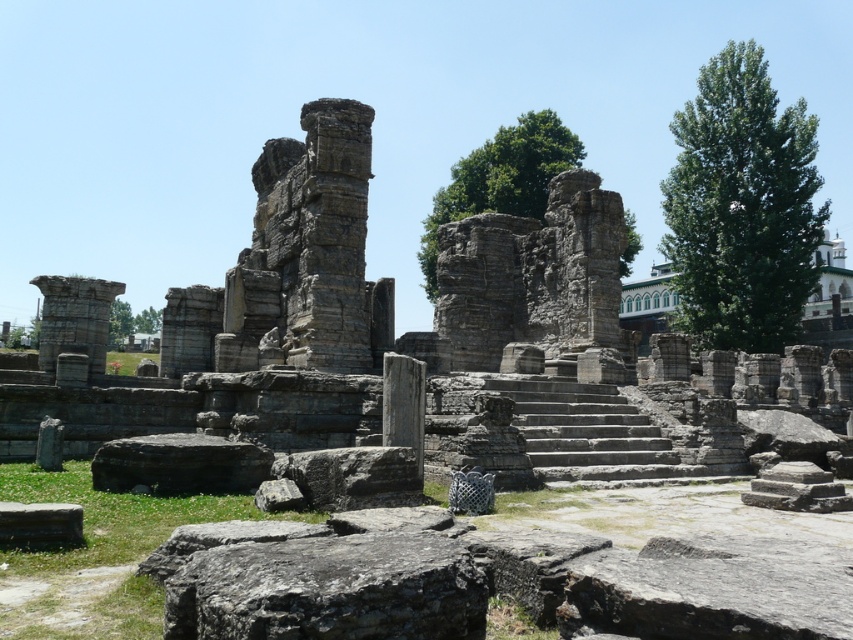
Question: Is gray rough stone at center thinner than gray stone at lower left?

Choices:
 (A) no
 (B) yes

Answer: (A)

Question: Considering the relative positions of gray rough stone at center and gray stone at lower left in the image provided, where is gray rough stone at center located with respect to gray stone at lower left?

Choices:
 (A) below
 (B) above

Answer: (A)

Question: Which object appears farthest from the camera in this image?

Choices:
 (A) gray stone at lower left
 (B) gray rough stone at center
 (C) gray rough stone at lower center

Answer: (C)

Question: Estimate the real-world distances between objects in this image. Which object is closer to the gray rough stone at center?

Choices:
 (A) gray stone at lower left
 (B) gray rough stone at lower center

Answer: (A)

Question: Is gray rough stone at lower center bigger than gray stone at lower left?

Choices:
 (A) no
 (B) yes

Answer: (B)

Question: Estimate the real-world distances between objects in this image. Which object is closer to the gray rough stone at center?

Choices:
 (A) gray rough stone at lower center
 (B) gray stone at lower left

Answer: (B)